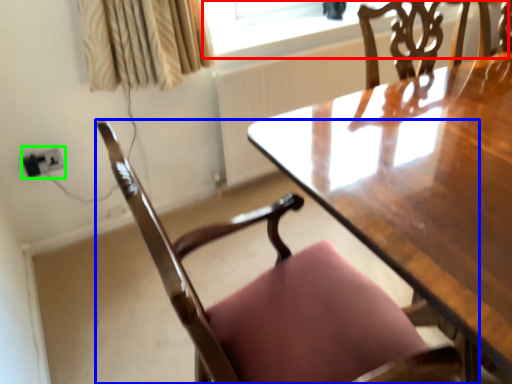
Question: Which is nearer to the window screen (highlighted by a red box)? chair (highlighted by a blue box) or electric outlet (highlighted by a green box).

Choices:
 (A) chair
 (B) electric outlet

Answer: (B)